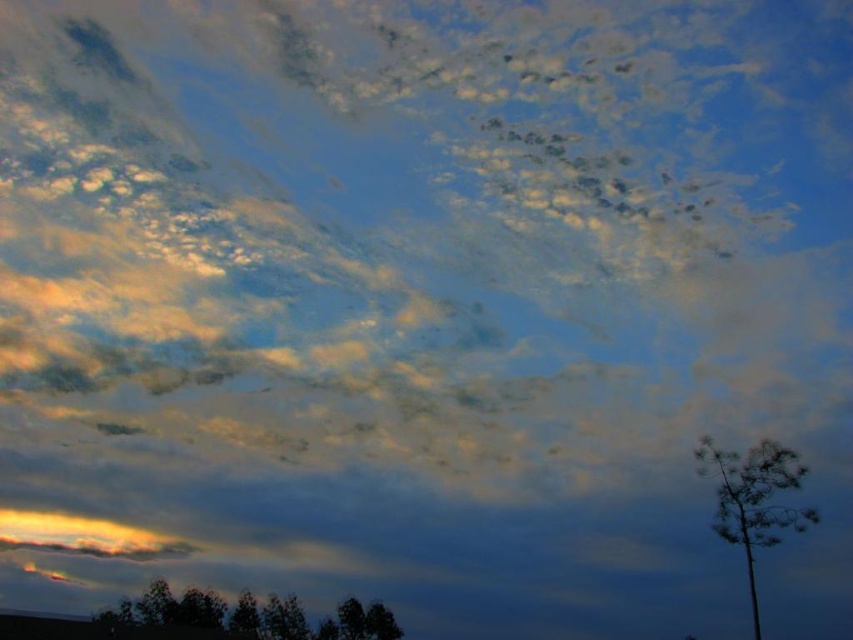
Who is higher up, dark green leafy tree at lower center or silhouette bark tree at right?

silhouette bark tree at right is higher up.

Between dark green leafy tree at lower center and silhouette bark tree at right, which one has more height?

With more height is dark green leafy tree at lower center.

Is point (381, 609) positioned behind point (728, 532)?

Yes.

The width and height of the screenshot is (853, 640). In order to click on dark green leafy tree at lower center in this screenshot , I will do `click(251, 616)`.